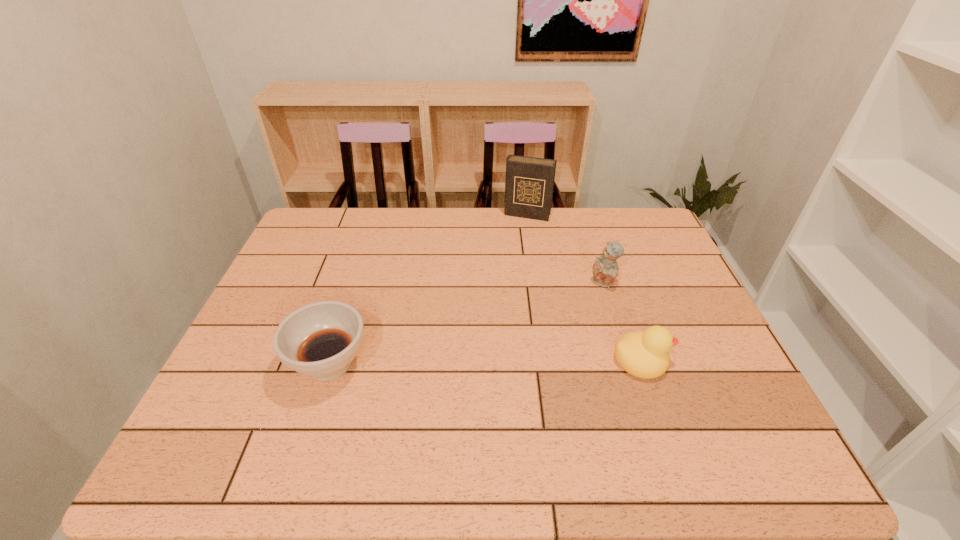
The height and width of the screenshot is (540, 960). Find the location of `the leftmost object`. the leftmost object is located at coordinates (320, 340).

Where is `duckling`? The width and height of the screenshot is (960, 540). duckling is located at coordinates (644, 354).

Find the location of a particular element. The image size is (960, 540). the third object from right to left is located at coordinates (529, 183).

You are a GUI agent. You are given a task and a screenshot of the screen. Output one action in this format:
    pyautogui.click(x=<x>, y=<y>)
    Task: Click on the tallest object
    
    Given the screenshot: What is the action you would take?
    pyautogui.click(x=529, y=183)

Where is `teddy bear`? teddy bear is located at coordinates (605, 269).

At what (x,y) coordinates should I click in order to perform the action: click on the third shortest object. Please return your answer as a coordinate pair (x, y). Looking at the image, I should click on (605, 269).

The height and width of the screenshot is (540, 960). I want to click on free spot located 0.390m on the back of the leftmost object, so 369,241.

At what (x,y) coordinates should I click in order to perform the action: click on vacant region located on the face of the duckling. Please return your answer as a coordinate pair (x, y). The width and height of the screenshot is (960, 540). Looking at the image, I should click on (695, 360).

You are a GUI agent. You are given a task and a screenshot of the screen. Output one action in this format:
    pyautogui.click(x=<x>, y=<y>)
    Task: Click on the free space located on the front cover of the third object from right to left
    
    Given the screenshot: What is the action you would take?
    pyautogui.click(x=511, y=255)

In order to click on free space located 0.140m on the front cover of the third object from right to left in this screenshot , I will do `click(514, 245)`.